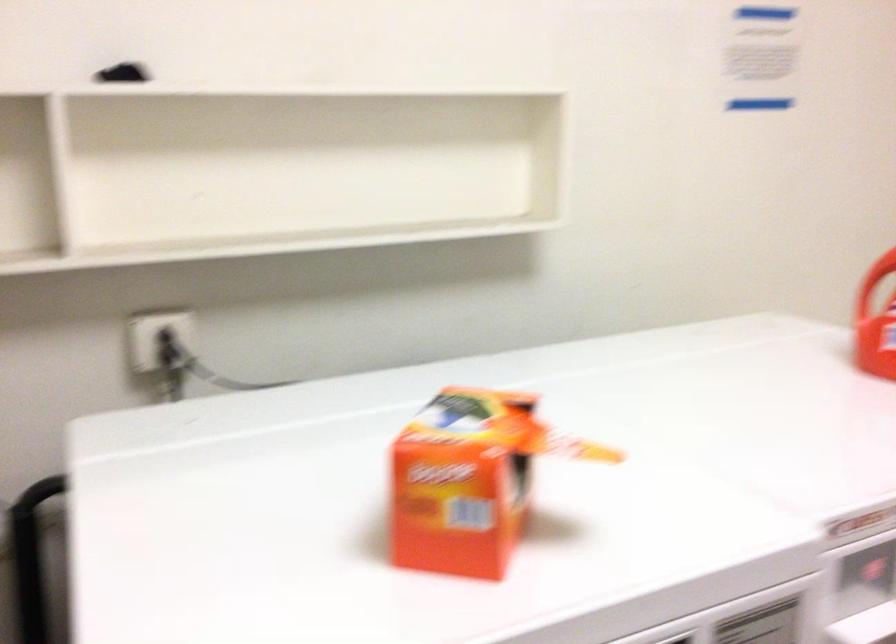
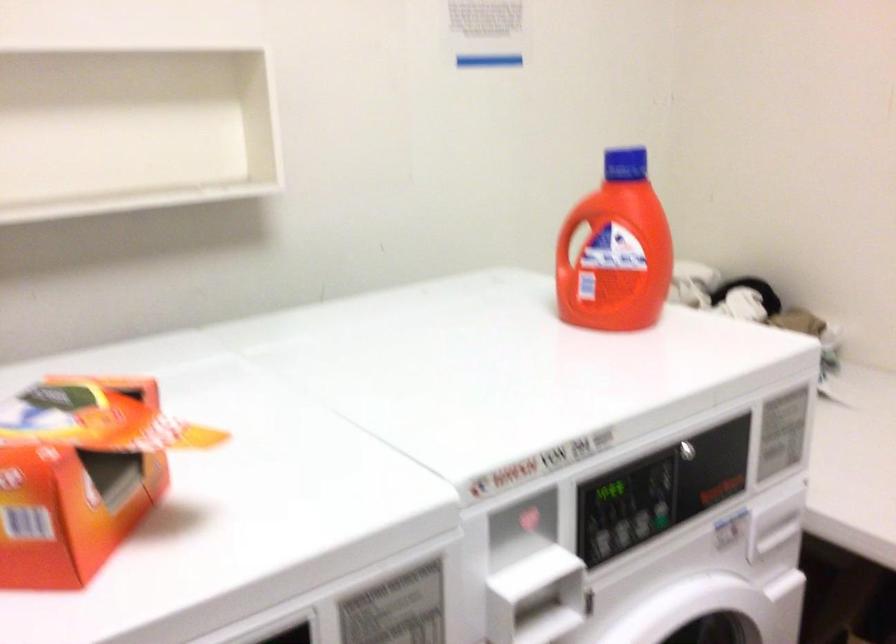
Question: Based on the continuous images, in which direction is the camera rotating? Reply with the corresponding letter.

Choices:
 (A) Left
 (B) Right
 (C) Up
 (D) Down

Answer: (B)